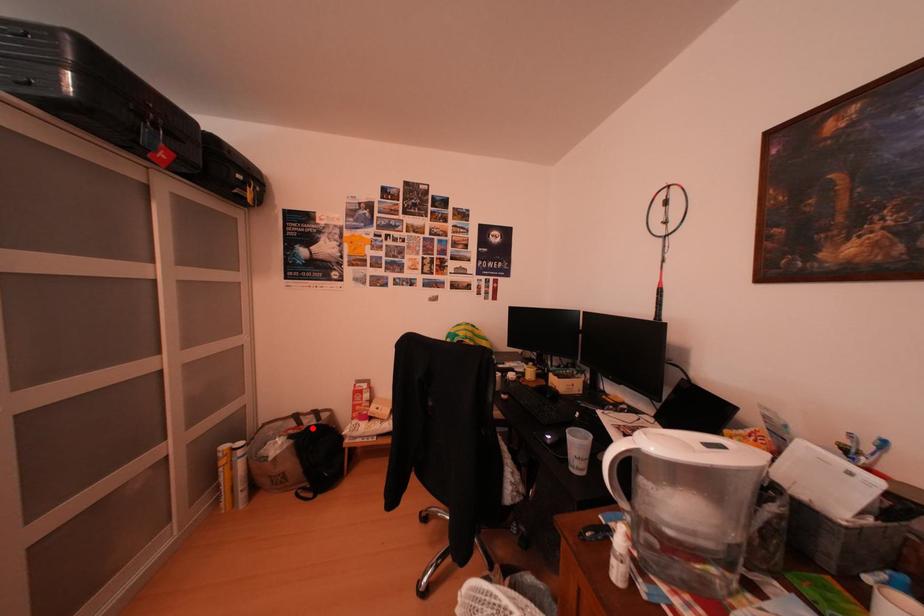
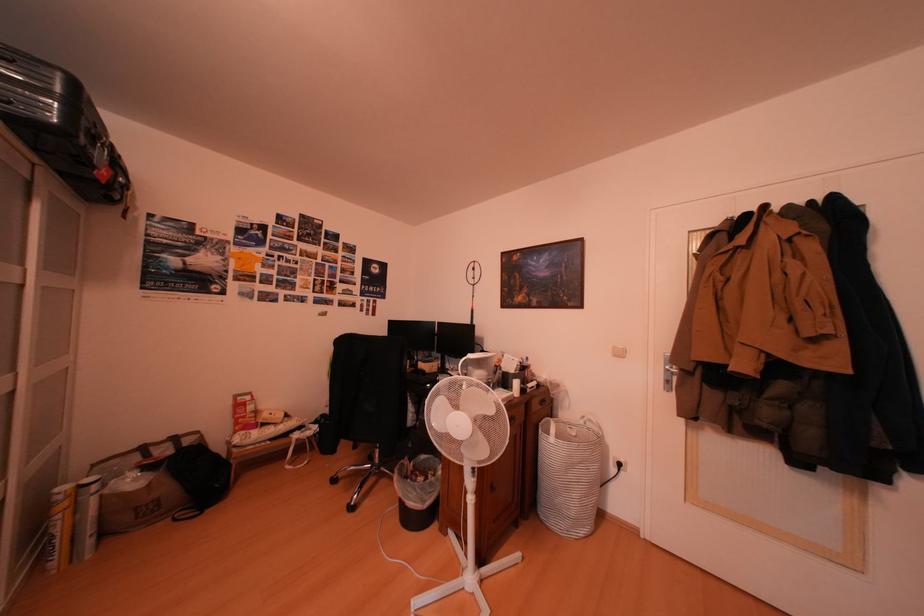
Question: A red point is marked in image1. In image2, is the corresponding 3D point closer to the camera or farther? Reply with the corresponding letter.

Choices:
 (A) The corresponding 3D point is closer.
 (B) The corresponding 3D point is farther.

Answer: (A)